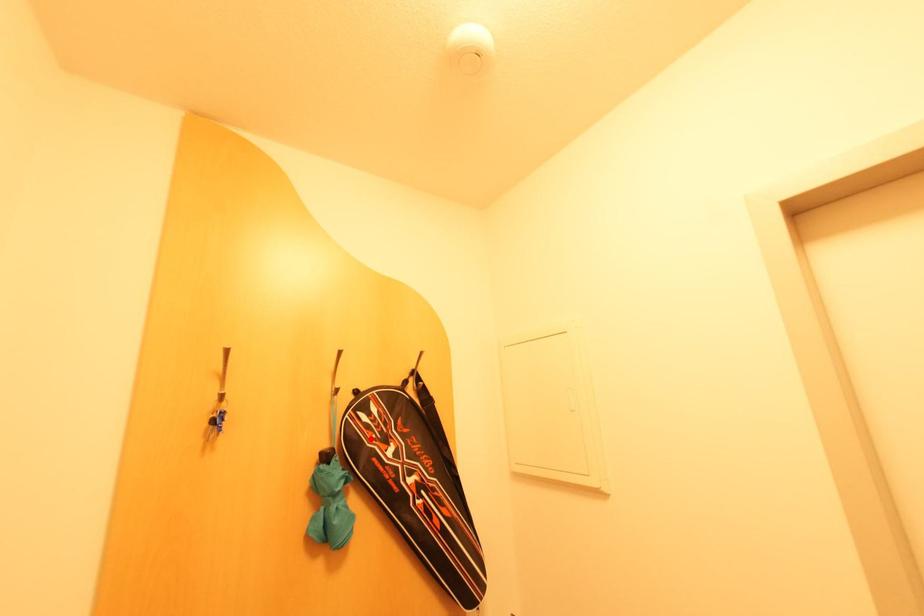
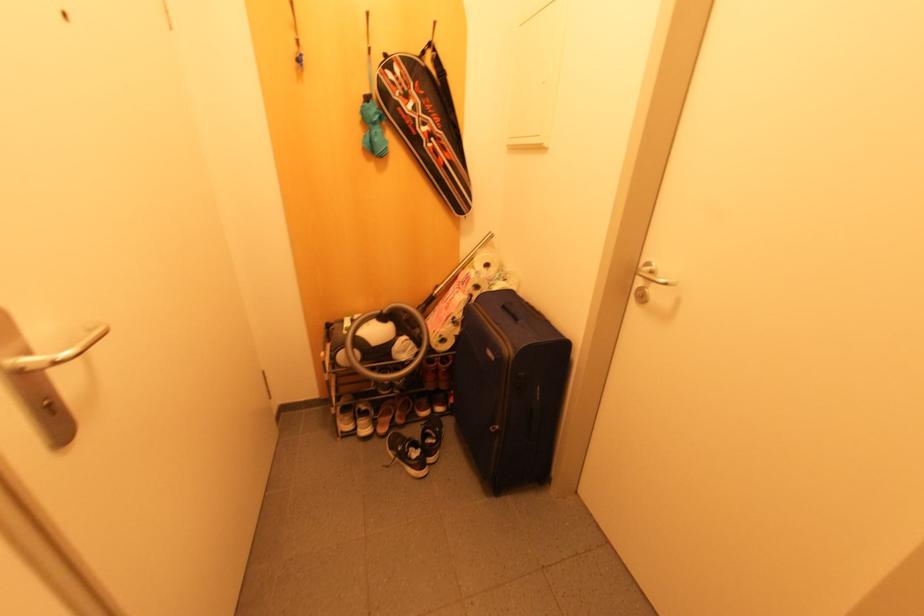
In the second image, find the point that corresponds to the highlighted location in the first image.

(395, 94)